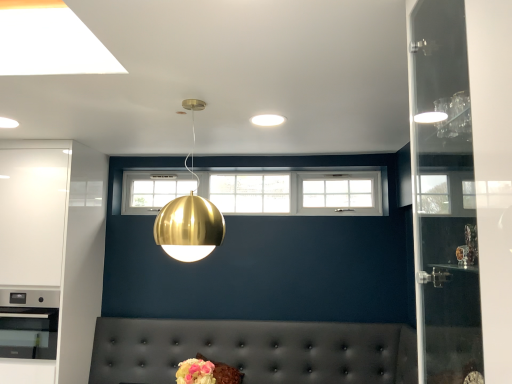
Question: Considering their positions, is white glossy cabinet at left located in front of or behind white matte light fixture at center?

Choices:
 (A) behind
 (B) front

Answer: (A)

Question: Would you say white glossy cabinet at left is to the left or to the right of white matte light fixture at center in the picture?

Choices:
 (A) left
 (B) right

Answer: (A)

Question: Considering the real-world distances, which object is closest to the white glossy cabinet at left?

Choices:
 (A) gold metallic sphere at center
 (B) tufted leather couch at lower center
 (C) white matte light fixture at center

Answer: (B)

Question: Estimate the real-world distances between objects in this image. Which object is closer to the gold metallic sphere at center?

Choices:
 (A) tufted leather couch at lower center
 (B) white glossy cabinet at left
 (C) white matte light fixture at center

Answer: (C)